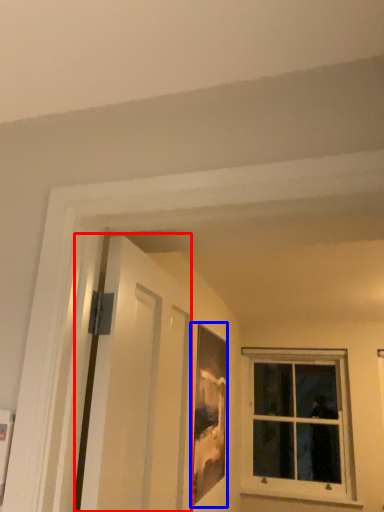
Question: Which of the following is the closest to the observer, screen door (highlighted by a red box) or picture frame (highlighted by a blue box)?

Choices:
 (A) screen door
 (B) picture frame

Answer: (A)